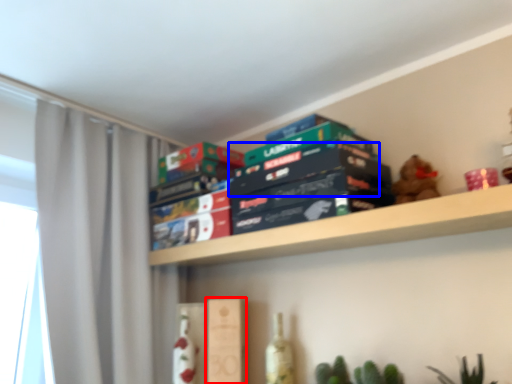
Question: Which object appears farthest to the camera in this image, paperback book (highlighted by a red box) or paperback book (highlighted by a blue box)?

Choices:
 (A) paperback book
 (B) paperback book

Answer: (A)